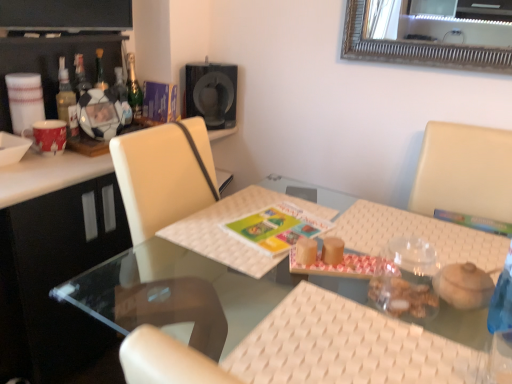
Question: Is red glossy mug at left smaller than black matte speaker at upper center?

Choices:
 (A) no
 (B) yes

Answer: (B)

Question: Does red glossy mug at left lie behind black matte speaker at upper center?

Choices:
 (A) no
 (B) yes

Answer: (A)

Question: Is red glossy mug at left directly adjacent to black matte speaker at upper center?

Choices:
 (A) no
 (B) yes

Answer: (A)

Question: Can you confirm if red glossy mug at left is bigger than black matte speaker at upper center?

Choices:
 (A) yes
 (B) no

Answer: (B)

Question: From the image's perspective, would you say red glossy mug at left is shown under black matte speaker at upper center?

Choices:
 (A) no
 (B) yes

Answer: (B)

Question: Does red glossy mug at left have a greater width compared to black matte speaker at upper center?

Choices:
 (A) yes
 (B) no

Answer: (B)

Question: Is white woven mat at left further to the viewer compared to translucent glass bottle at left, marked as the first bottle in a front-to-back arrangement?

Choices:
 (A) yes
 (B) no

Answer: (B)

Question: Is translucent glass bottle at left, the third bottle positioned from the back, located within white woven mat at left?

Choices:
 (A) yes
 (B) no

Answer: (B)

Question: Considering the relative sizes of white woven mat at left and translucent glass bottle at left, marked as the first bottle in a front-to-back arrangement, in the image provided, is white woven mat at left bigger than translucent glass bottle at left, marked as the first bottle in a front-to-back arrangement,?

Choices:
 (A) no
 (B) yes

Answer: (B)

Question: From a real-world perspective, is white woven mat at left positioned under translucent glass bottle at left, the third bottle positioned from the back, based on gravity?

Choices:
 (A) yes
 (B) no

Answer: (A)

Question: From the image's perspective, is white woven mat at left below translucent glass bottle at left, marked as the first bottle in a front-to-back arrangement?

Choices:
 (A) yes
 (B) no

Answer: (A)

Question: Is white woven mat at left thinner than translucent glass bottle at left, the third bottle positioned from the back?

Choices:
 (A) yes
 (B) no

Answer: (B)

Question: From a real-world perspective, is matte plastic soccer ball at left positioned under white woven placemat at center, the second place mat in the right-to-left sequence, based on gravity?

Choices:
 (A) yes
 (B) no

Answer: (B)